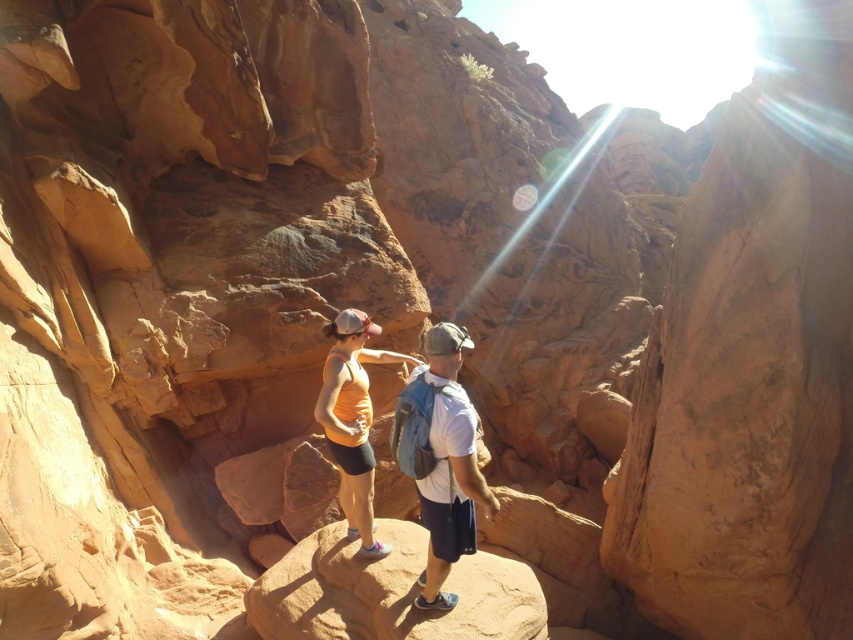
In the scene shown: You are a photographer positioned at the entrance of the canyon. You notice two hikers wearing a white matte shirt at center and an orange fabric tank top at center. Which hiker is positioned closer to you?

The white matte shirt at center is closer to the viewer than the orange fabric tank top at center, so the hiker wearing the white matte shirt at center is closer to you.